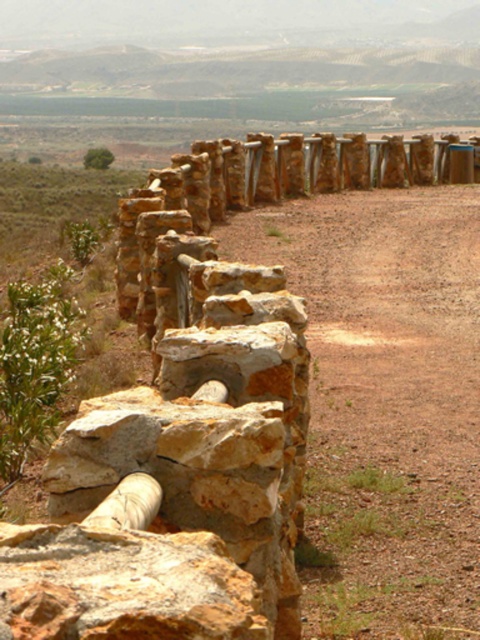
You are standing on the brown gravel path at center and want to reach the rusty stone wall at center. Which direction should you move to get there?

The brown gravel path at center is to the right of the rusty stone wall at center, so you should move to your left to reach the wall.